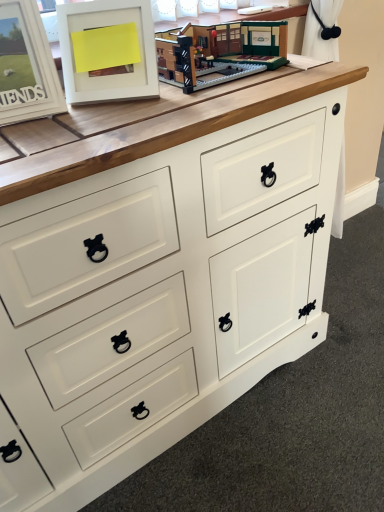
Locate an element on the screen. The height and width of the screenshot is (512, 384). vacant area that lies in front of brick-like lego set at upper center is located at coordinates (211, 94).